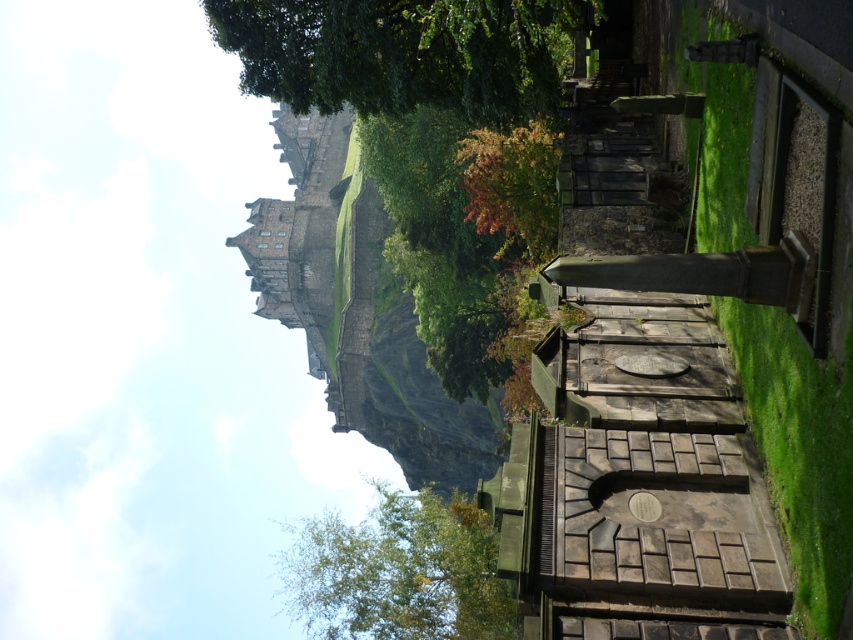
Which is behind, point (316, 6) or point (502, 170)?

Point (502, 170)

Measure the distance between point [231,13] and camera.

Point [231,13] and camera are 46.07 meters apart.

The width and height of the screenshot is (853, 640). Identify the location of green leafy tree at upper center. 403,52.

Does green leafy tree at center lie behind orange leafy tree at center?

That is True.

Between green leafy tree at center and orange leafy tree at center, which one is positioned higher?

Positioned higher is orange leafy tree at center.

Does point (460, 577) lie in front of point (497, 132)?

No, it is behind (497, 132).

This screenshot has width=853, height=640. I want to click on green leafy tree at center, so click(x=399, y=572).

In the scene shown: Who is lower down, green leafy tree at upper center or green leafy tree at center?

green leafy tree at center is below.

Is green leafy tree at upper center shorter than green leafy tree at center?

Indeed, green leafy tree at upper center has a lesser height compared to green leafy tree at center.

The image size is (853, 640). Describe the element at coordinates (403, 52) in the screenshot. I see `green leafy tree at upper center` at that location.

Where is `green leafy tree at upper center`? green leafy tree at upper center is located at coordinates (403, 52).